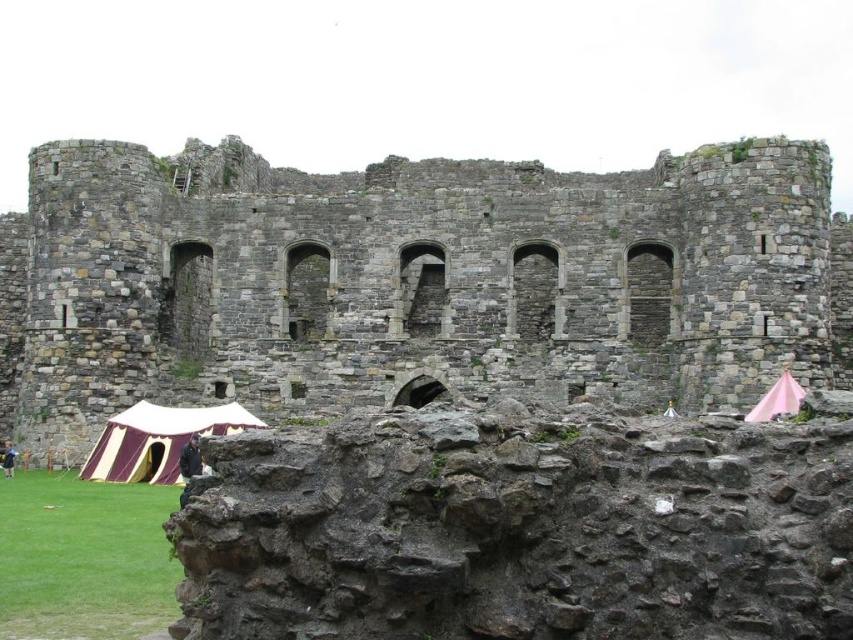
You are a traveler approaching the rusty stone castle at center and the maroon canvas tent at lower left. Which structure is wider?

The rusty stone castle at center is wider than the maroon canvas tent at lower left.

You are an archaeologist standing at the entrance of the rusty stone castle at center. You notice a maroon canvas tent at lower left in the distance. Which object is closer to you?

The rusty stone castle at center is closer to you because it is in front of the maroon canvas tent at lower left.